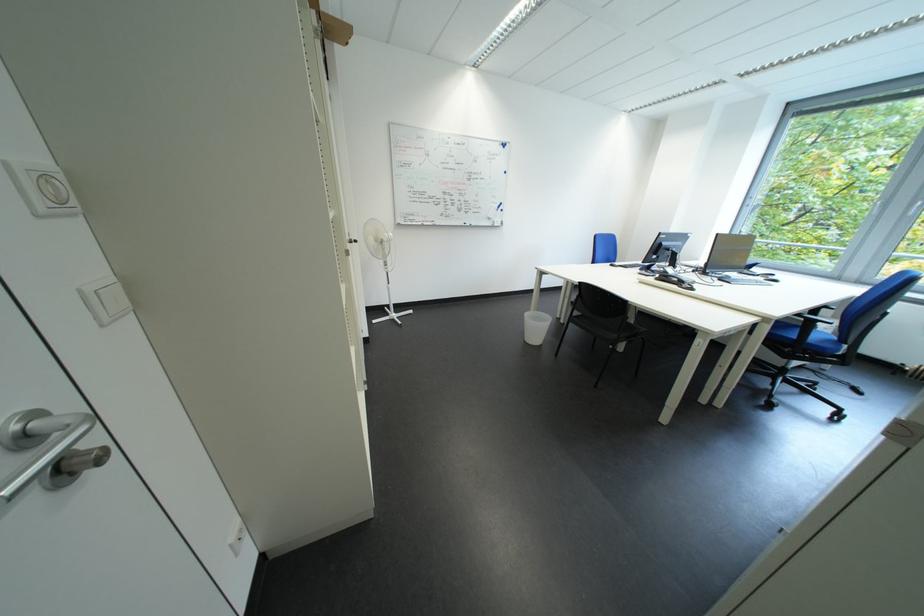
Where is `telephone handset`? The image size is (924, 616). telephone handset is located at coordinates (675, 281).